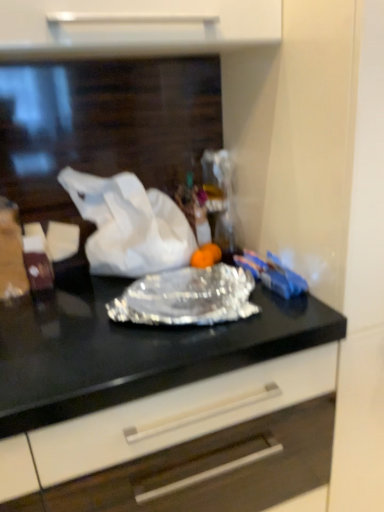
You are a GUI agent. You are given a task and a screenshot of the screen. Output one action in this format:
    pyautogui.click(x=<x>, y=<y>)
    Task: Click on the free space to the left of silver foil wrap at center
    Image resolution: width=384 pixels, height=512 pixels.
    Given the screenshot: What is the action you would take?
    pyautogui.click(x=55, y=338)